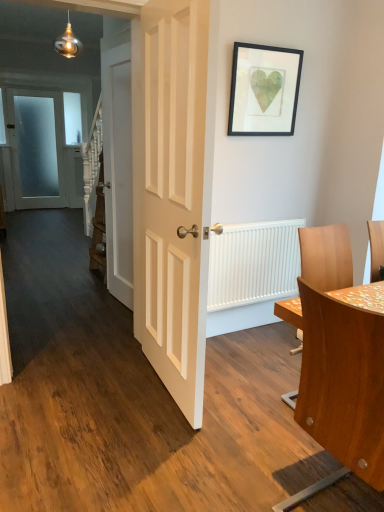
You are a GUI agent. You are given a task and a screenshot of the screen. Output one action in this format:
    pyautogui.click(x=<x>, y=<y>)
    Task: Click on the free space between white glossy door at center, which appears as the 1th door when viewed from the right, and white ribbed radiator at right
    
    Given the screenshot: What is the action you would take?
    pyautogui.click(x=243, y=361)